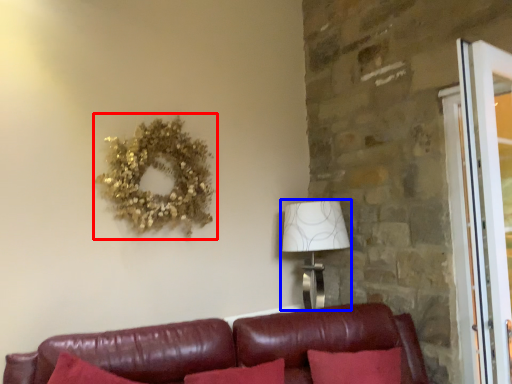
Question: Which object appears closest to the camera in this image, decor (highlighted by a red box) or table lamp (highlighted by a blue box)?

Choices:
 (A) decor
 (B) table lamp

Answer: (A)